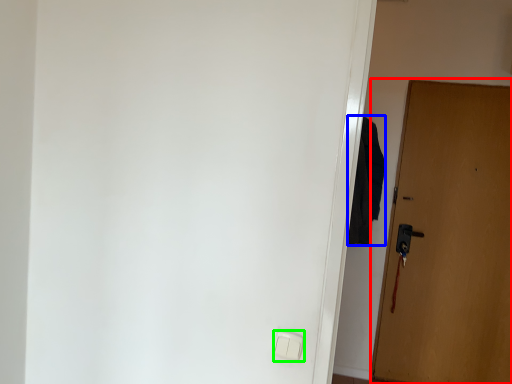
Question: Which object is the closest to the door (highlighted by a red box)? Choose among these: robe (highlighted by a blue box) or light switch (highlighted by a green box).

Choices:
 (A) robe
 (B) light switch

Answer: (A)